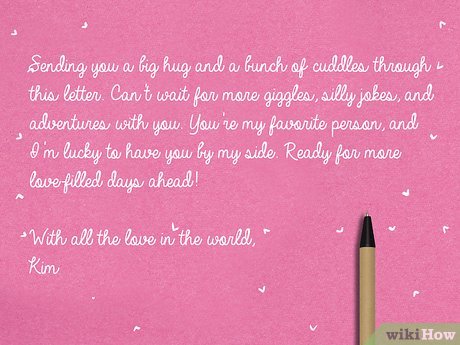
This screenshot has height=345, width=460. Find the location of `pen`. pen is located at coordinates coord(373,272).